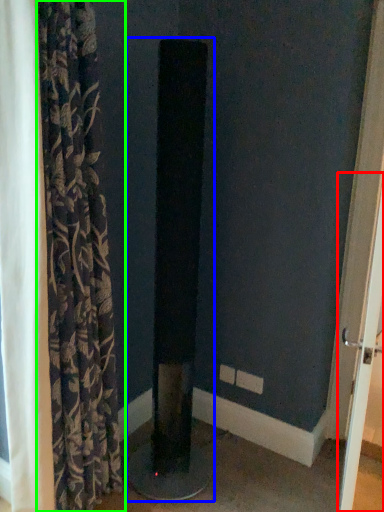
Question: Which object is the farthest from screen door (highlighted by a red box)? Choose among these: pillar (highlighted by a blue box) or curtain (highlighted by a green box).

Choices:
 (A) pillar
 (B) curtain

Answer: (B)